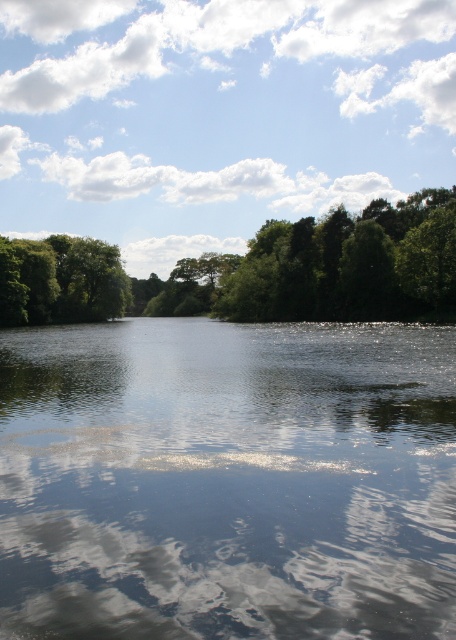
Question: Estimate the real-world distances between objects in this image. Which object is farther from the green leafy trees at upper center?

Choices:
 (A) white fluffy cloud at upper center
 (B) green leafy trees at left

Answer: (A)

Question: Where is transparent water at center located in relation to green leafy trees at upper center in the image?

Choices:
 (A) right
 (B) left

Answer: (A)

Question: Which point is farther from the camera taking this photo?

Choices:
 (A) (150, 323)
 (B) (102, 307)
 (C) (381, 212)

Answer: (A)

Question: Does white fluffy cloud at upper center have a smaller size compared to green leafy trees at upper center?

Choices:
 (A) no
 (B) yes

Answer: (A)

Question: Does transparent water at center come in front of green leafy trees at left?

Choices:
 (A) yes
 (B) no

Answer: (A)

Question: Estimate the real-world distances between objects in this image. Which object is closer to the transparent water at center?

Choices:
 (A) white fluffy cloud at upper center
 (B) green leafy trees at left

Answer: (B)